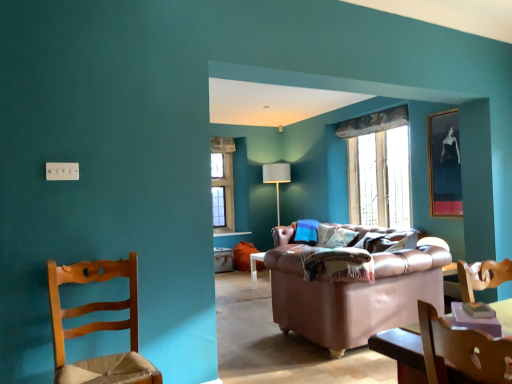
What do you see at coordinates (341, 238) in the screenshot?
I see `soft blue fabric pillow at center` at bounding box center [341, 238].

In order to click on clear glass window at center in this screenshot , I will do `click(379, 168)`.

Can you confirm if clear glass window at center is wider than soft blue fabric pillow at center?

No, clear glass window at center is not wider than soft blue fabric pillow at center.

From a real-world perspective, who is located lower, clear glass window at center or soft blue fabric pillow at center?

From a 3D spatial view, soft blue fabric pillow at center is below.

Considering the sizes of objects clear glass window at center and soft blue fabric pillow at center in the image provided, who is smaller, clear glass window at center or soft blue fabric pillow at center?

Smaller between the two is soft blue fabric pillow at center.

Is matte black picture frame at upper right closer to the viewer compared to soft blue fabric pillow at center?

Yes.

Would you say matte black picture frame at upper right contains soft blue fabric pillow at center?

Actually, soft blue fabric pillow at center is outside matte black picture frame at upper right.

Between point (451, 192) and point (341, 232), which one is positioned behind?

The point (341, 232) is more distant.

From a real-world perspective, is leather couch at center under wooden chair at left?

Yes, from a real-world perspective, leather couch at center is beneath wooden chair at left.

Locate an element on the screen. This screenshot has width=512, height=384. chair located above the leather couch at center (from a real-world perspective) is located at coordinates (98, 326).

Considering the relative positions of leather couch at center and wooden chair at left in the image provided, is leather couch at center in front of wooden chair at left?

That is False.

Can you confirm if leather couch at center is positioned to the right of wooden chair at left?

Correct, you'll find leather couch at center to the right of wooden chair at left.

Is soft blue fabric pillow at center closer to the viewer compared to white plastic electric outlet at upper left?

No, soft blue fabric pillow at center is further to the viewer.

Is white plastic electric outlet at upper left surrounded by soft blue fabric pillow at center?

No, white plastic electric outlet at upper left is located outside of soft blue fabric pillow at center.

In the image, is matte black picture frame at upper right positioned in front of or behind leather couch at center?

matte black picture frame at upper right is behind leather couch at center.

Considering the sizes of matte black picture frame at upper right and leather couch at center in the image, is matte black picture frame at upper right taller or shorter than leather couch at center?

Clearly, matte black picture frame at upper right is taller compared to leather couch at center.

This screenshot has width=512, height=384. I want to click on picture frame that appears on the right of leather couch at center, so click(x=444, y=164).

From the image's perspective, between clear glass window at center and white plastic electric outlet at upper left, which one is located above?

clear glass window at center is shown above in the image.

Could white plastic electric outlet at upper left be considered to be inside clear glass window at center?

Result: No, white plastic electric outlet at upper left is not a part of clear glass window at center.

Considering the relative positions of clear glass window at center and white plastic electric outlet at upper left in the image provided, is clear glass window at center in front of white plastic electric outlet at upper left?

No, it is not.

How many degrees apart are the facing directions of clear glass window at center and white plastic electric outlet at upper left?

There is a 91-degree angle between the facing directions of clear glass window at center and white plastic electric outlet at upper left.

How distant is wooden chair at left from soft blue fabric pillow at center?

A distance of 11.07 feet exists between wooden chair at left and soft blue fabric pillow at center.

Considering the relative sizes of wooden chair at left and soft blue fabric pillow at center in the image provided, is wooden chair at left bigger than soft blue fabric pillow at center?

Indeed, wooden chair at left has a larger size compared to soft blue fabric pillow at center.

Which is more to the left, wooden chair at left or soft blue fabric pillow at center?

Positioned to the left is wooden chair at left.

From a real-world perspective, is wooden chair at left positioned over soft blue fabric pillow at center based on gravity?

Actually, wooden chair at left is physically below soft blue fabric pillow at center in the real world.

Locate an element on the screen. window lying on the right of soft blue fabric pillow at center is located at coordinates (379, 168).

This screenshot has width=512, height=384. In order to click on pillow lying below the matte black picture frame at upper right (from the image's perspective) in this screenshot , I will do `click(341, 238)`.

Which object lies nearer to the anchor point clear glass window at center, leather couch at center or matte black picture frame at upper right?

matte black picture frame at upper right lies closer to clear glass window at center than the other object.

When comparing their distances from clear glass window at center, does matte black picture frame at upper right or wooden chair at left seem further?

Based on the image, wooden chair at left appears to be further to clear glass window at center.

Which object lies further to the anchor point matte black picture frame at upper right, clear glass window at center or white plastic electric outlet at upper left?

The object further to matte black picture frame at upper right is white plastic electric outlet at upper left.

When comparing their distances from leather couch at center, does matte black picture frame at upper right or soft blue fabric pillow at center seem closer?

The object closer to leather couch at center is matte black picture frame at upper right.

From the image, which object appears to be nearer to clear glass window at center, leather couch at center or wooden chair at left?

The object closer to clear glass window at center is leather couch at center.

Consider the image. From the image, which object appears to be farther from matte black picture frame at upper right, white plastic electric outlet at upper left or soft blue fabric pillow at center?

Based on the image, white plastic electric outlet at upper left appears to be further to matte black picture frame at upper right.

Based on their spatial positions, is matte black picture frame at upper right or clear glass window at center closer to leather couch at center?

matte black picture frame at upper right is closer to leather couch at center.

Based on their spatial positions, is wooden chair at left or clear glass window at center closer to matte black picture frame at upper right?

Among the two, clear glass window at center is located nearer to matte black picture frame at upper right.

Image resolution: width=512 pixels, height=384 pixels. Identify the location of studio couch located between white plastic electric outlet at upper left and matte black picture frame at upper right in the left-right direction. (353, 293).

You are a GUI agent. You are given a task and a screenshot of the screen. Output one action in this format:
    pyautogui.click(x=<x>, y=<y>)
    Task: Click on the studio couch between white plastic electric outlet at upper left and clear glass window at center along the z-axis
    
    Given the screenshot: What is the action you would take?
    pyautogui.click(x=353, y=293)

The height and width of the screenshot is (384, 512). Find the location of `studio couch located between wooden chair at left and clear glass window at center in the depth direction`. studio couch located between wooden chair at left and clear glass window at center in the depth direction is located at coordinates (353, 293).

Find the location of `studio couch between wooden chair at left and soft blue fabric pillow at center from front to back`. studio couch between wooden chair at left and soft blue fabric pillow at center from front to back is located at coordinates (353, 293).